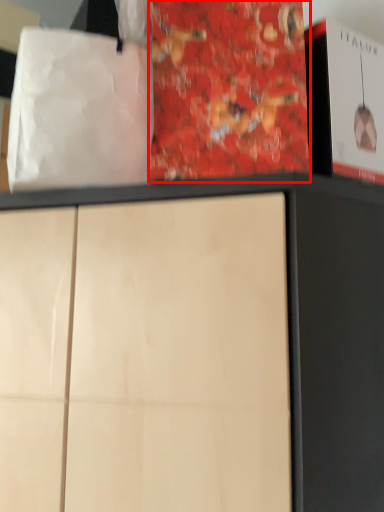
Question: From the image's perspective, where is paperback book (annotated by the red box) located in relation to tote bag in the image?

Choices:
 (A) above
 (B) below

Answer: (A)